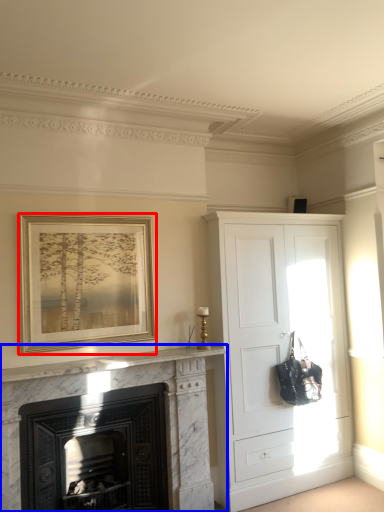
Question: Which point is closer to the camera, picture frame (highlighted by a red box) or fireplace (highlighted by a blue box)?

Choices:
 (A) picture frame
 (B) fireplace

Answer: (B)